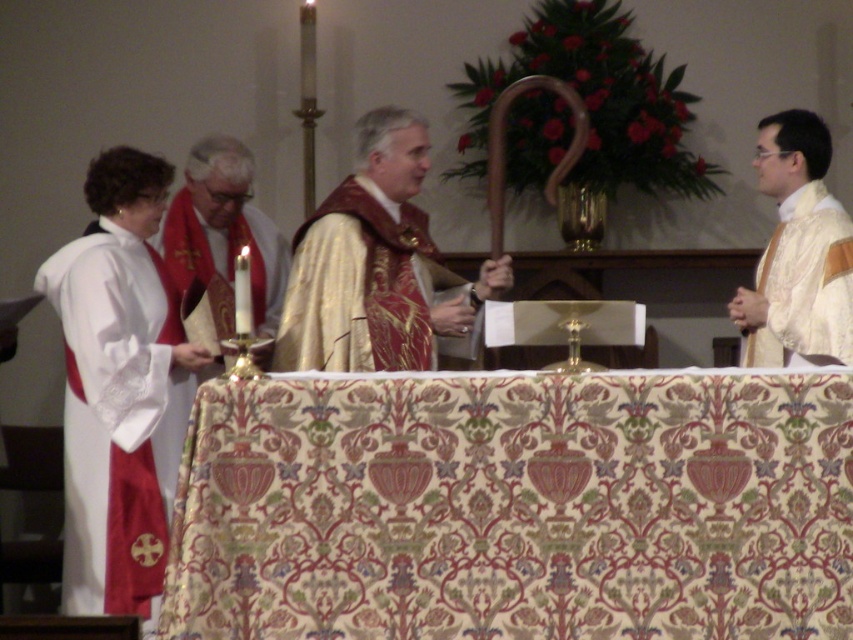
You are an observer in the church and see the gold embroidered robe at center and the white satin robe at right. Which robe is located to the left of the other?

The gold embroidered robe at center is positioned on the left side of white satin robe at right.

You are an assistant helping to prepare for a ceremony. You need to determine which robe, the white satin robe at left or the gold embroidered robe at center, is taller. Based on the description, which one is taller?

The white satin robe at left is taller than the gold embroidered robe at center.